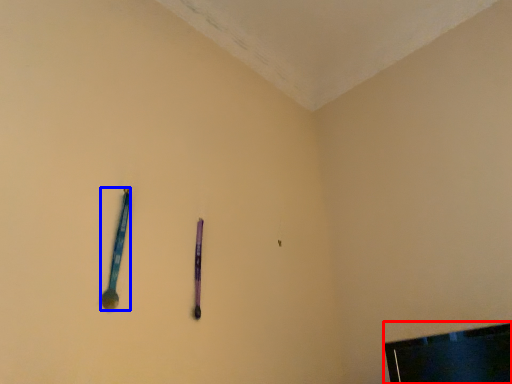
Question: Which point is closer to the camera, television (highlighted by a red box) or spoon (highlighted by a blue box)?

Choices:
 (A) television
 (B) spoon

Answer: (A)